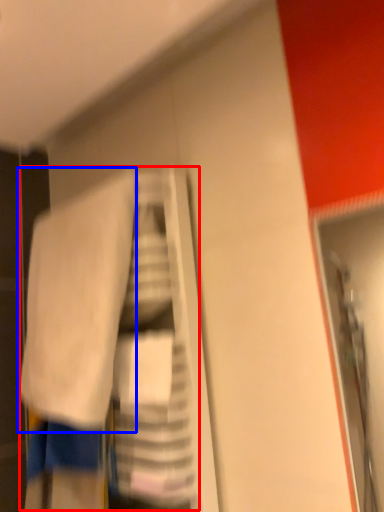
Question: Among these objects, which one is nearest to the camera, laundry (highlighted by a red box) or towel (highlighted by a blue box)?

Choices:
 (A) laundry
 (B) towel

Answer: (A)